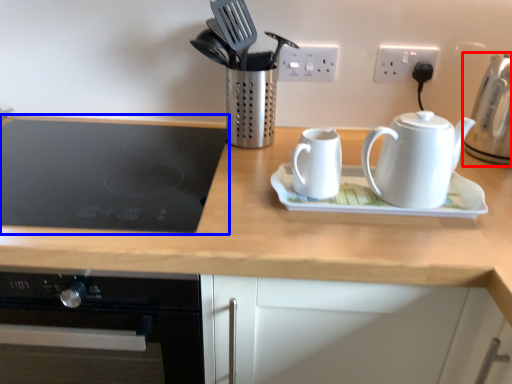
Question: Which object is closer to the camera taking this photo, kettle (highlighted by a red box) or gas stove (highlighted by a blue box)?

Choices:
 (A) kettle
 (B) gas stove

Answer: (B)